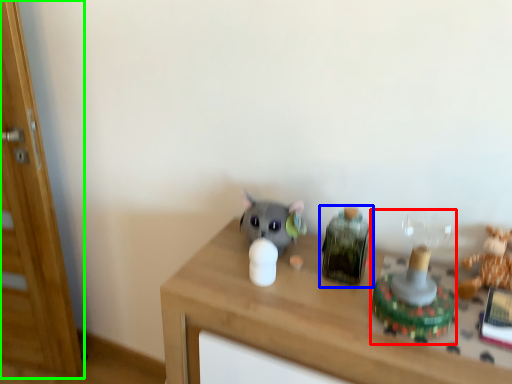
Question: Estimate the real-world distances between objects in this image. Which object is farther from toy (highlighted by a red box), toy (highlighted by a blue box) or glass door (highlighted by a green box)?

Choices:
 (A) toy
 (B) glass door

Answer: (B)